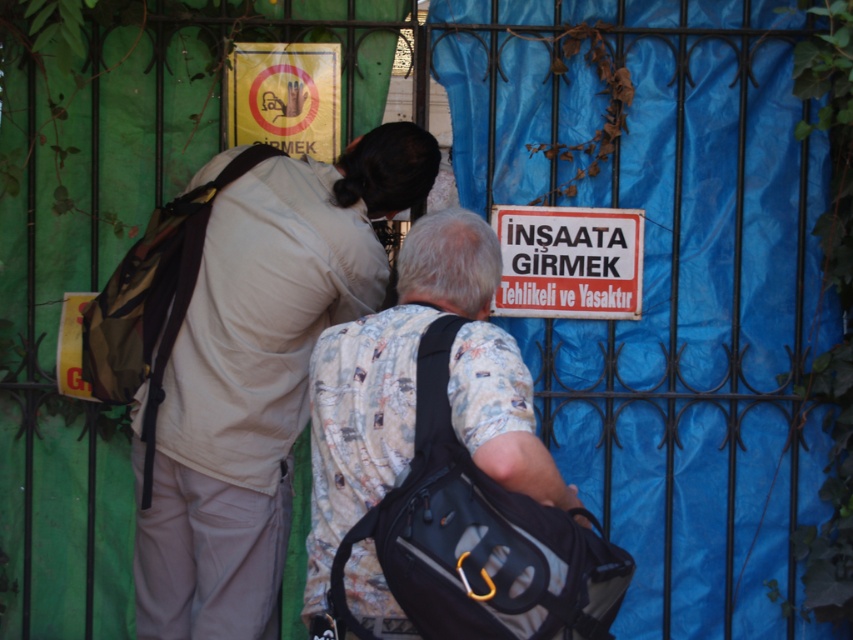
Question: Does matte beige shirt at center have a larger size compared to printed cotton shirt at center?

Choices:
 (A) yes
 (B) no

Answer: (A)

Question: Which point appears farthest from the camera in this image?

Choices:
 (A) (625, 305)
 (B) (291, 129)
 (C) (460, 438)

Answer: (A)

Question: Can you confirm if matte beige shirt at center is positioned below white paper sign at center?

Choices:
 (A) no
 (B) yes

Answer: (B)

Question: In this image, where is printed cotton shirt at center located relative to yellow paper sign at upper center?

Choices:
 (A) right
 (B) left

Answer: (A)

Question: Which of the following is the farthest from the observer?

Choices:
 (A) matte beige shirt at center
 (B) printed cotton shirt at center
 (C) white paper sign at center

Answer: (C)

Question: Which object is farther from the camera taking this photo?

Choices:
 (A) matte beige shirt at center
 (B) yellow paper sign at upper center
 (C) white paper sign at center
 (D) printed cotton shirt at center

Answer: (C)